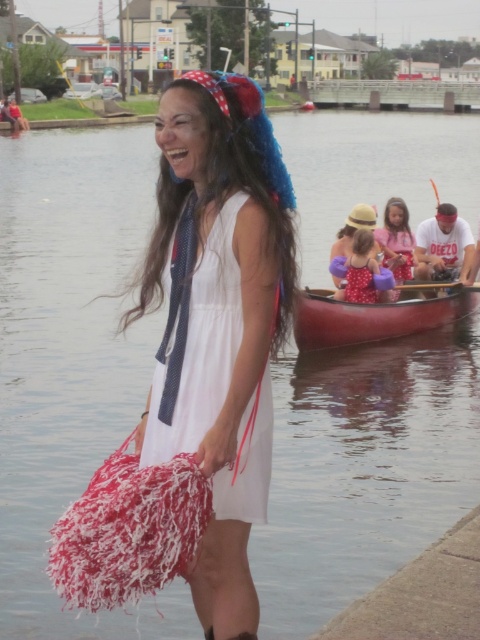
Please use the coordinates provided to identify the object in the scene. What object is located at point (374, 316)?

The smooth wood canoe at center is located at point (374, 316).

You are a photographer trying to capture the woman in the scene. You notice the white fabric dress at center and the polka dot dress at center. Which dress should you focus on to ensure it appears larger in your photo?

The white fabric dress at center is much taller than the polka dot dress at center, so focusing on it will make it appear larger in the photo.

You are planning to pack for a day at the beach and have both the white cotton dress at center and the matte pink swimsuit at center. Which item takes up more space in your bag?

The white cotton dress at center is bigger than the matte pink swimsuit at center, so it will take up more space in your bag.